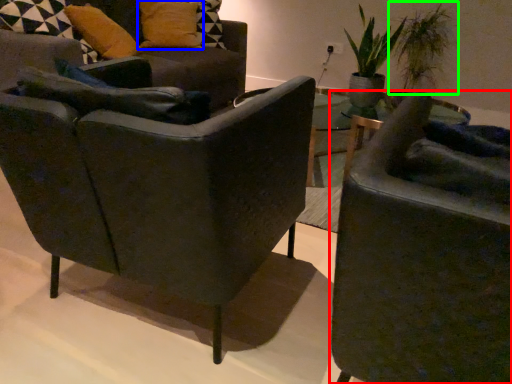
Question: Which object is positioned closest to chair (highlighted by a red box)? Select from pillow (highlighted by a blue box) and plant (highlighted by a green box).

Choices:
 (A) pillow
 (B) plant

Answer: (A)